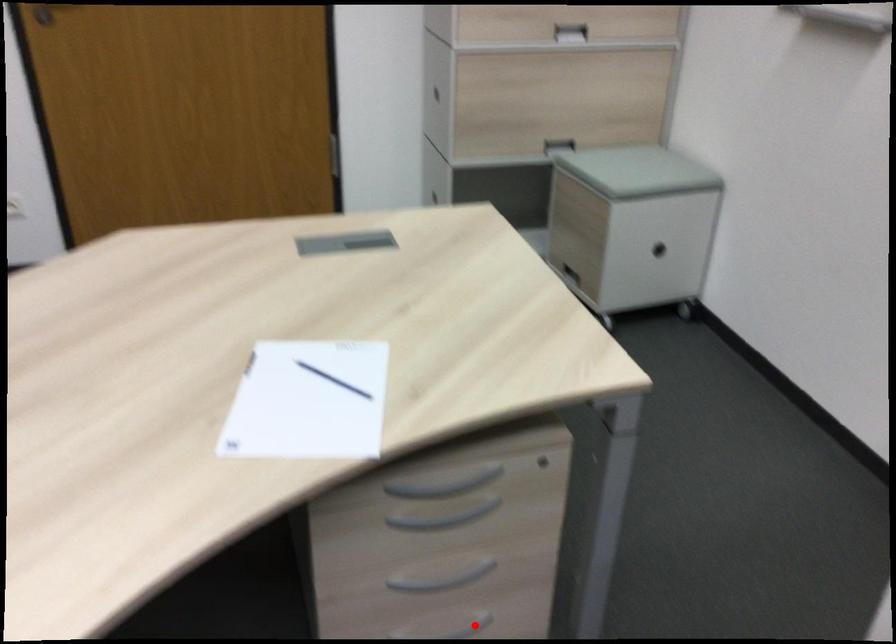
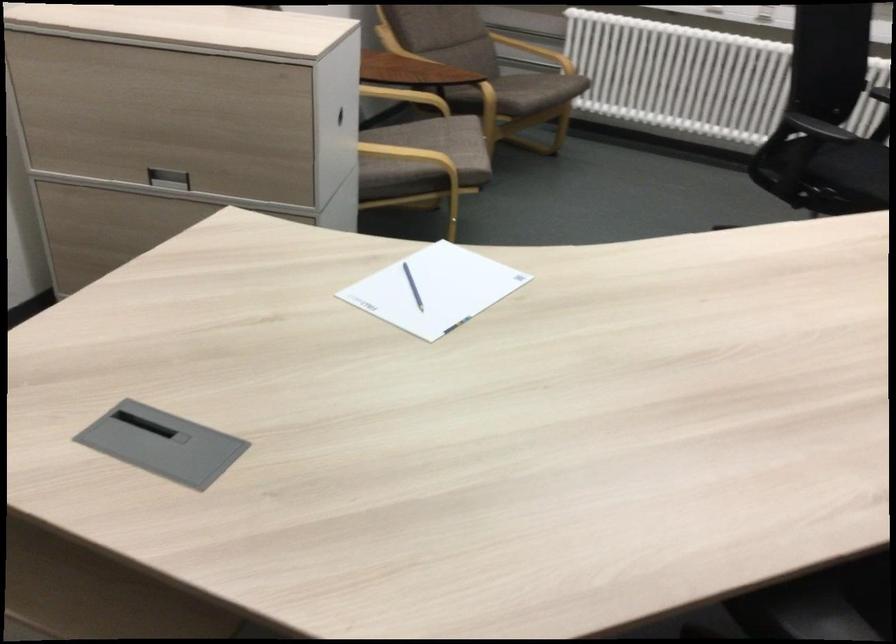
Question: I am providing you with two images of the same scene from different viewpoints. A red point is marked on the first image. At the location where the point appears in image 1, is it still visible in image 2?

Choices:
 (A) Yes
 (B) No

Answer: (B)